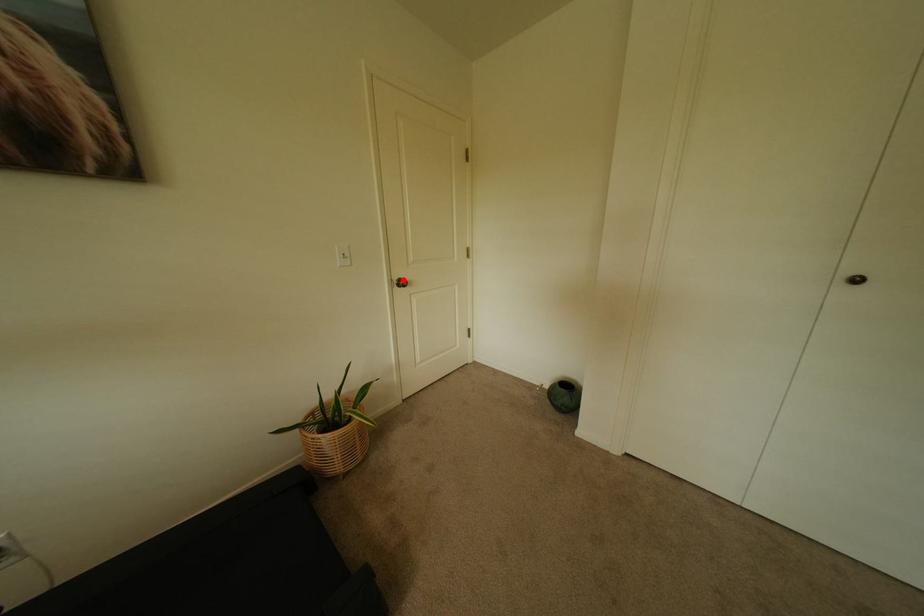
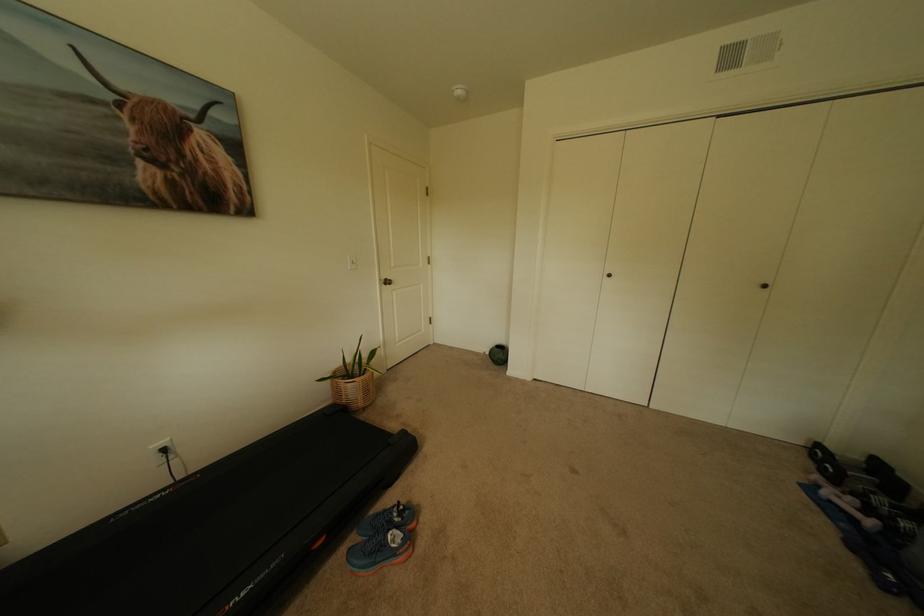
The point at the highlighted location is marked in the first image. Where is the corresponding point in the second image?

(391, 280)